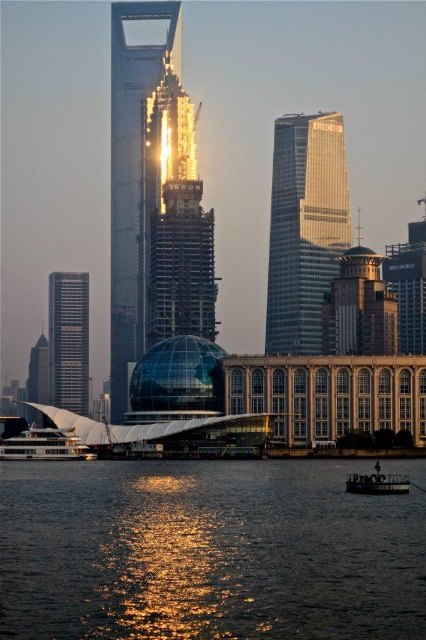
Question: Is glistening water at lower center thinner than glassy metallic skyscraper at center?

Choices:
 (A) no
 (B) yes

Answer: (A)

Question: Is glistening water at lower center to the left of white glossy boat at lower left from the viewer's perspective?

Choices:
 (A) no
 (B) yes

Answer: (A)

Question: Which object appears closest to the camera in this image?

Choices:
 (A) metallic glass skyscraper at left
 (B) glassy metallic skyscraper at center
 (C) transparent glass dome at center

Answer: (C)

Question: Is glistening water at lower center wider than white glossy boat at lower left?

Choices:
 (A) no
 (B) yes

Answer: (B)

Question: Which of the following is the closest to the observer?

Choices:
 (A) (43, 429)
 (B) (383, 636)

Answer: (B)

Question: Considering the real-world distances, which object is closest to the white glossy boat at lower left?

Choices:
 (A) metallic glass skyscraper at left
 (B) glassy metallic skyscraper at center

Answer: (B)